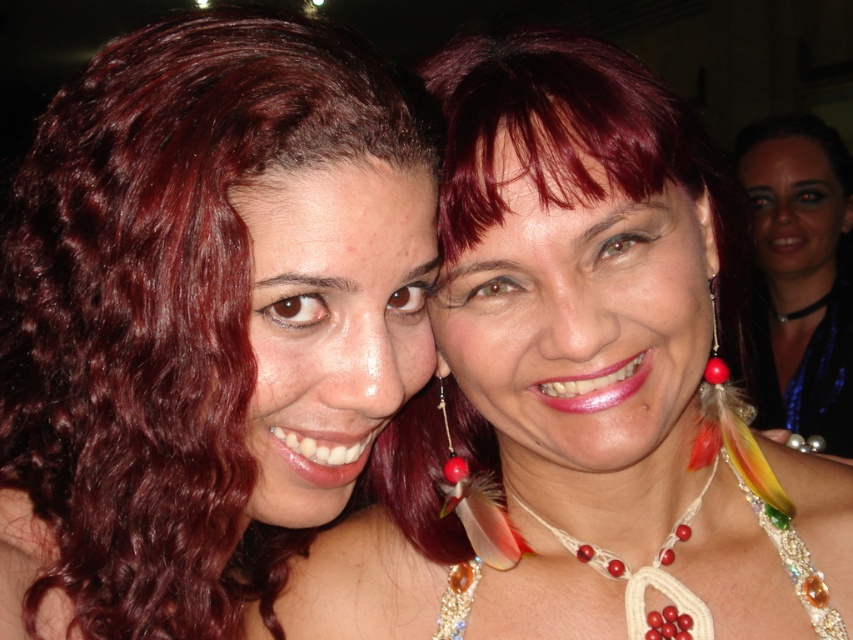
Question: Is the position of satin blue scarf at upper right more distant than that of blue sequined dress at upper right?

Choices:
 (A) yes
 (B) no

Answer: (A)

Question: Based on their relative distances, which object is nearer to the red glossy bead at ear?

Choices:
 (A) red beaded necklace at center
 (B) satin blue scarf at upper right

Answer: (A)

Question: Where is shiny red hair at upper left located in relation to blue sequined dress at upper right in the image?

Choices:
 (A) above
 (B) below

Answer: (A)

Question: Which object appears farthest from the camera in this image?

Choices:
 (A) satin blue scarf at upper right
 (B) blue sequined dress at upper right

Answer: (A)

Question: Which point is closer to the camera?

Choices:
 (A) red beaded necklace at center
 (B) shiny red hair at upper left
 (C) blue sequined dress at upper right
 (D) satin blue scarf at upper right

Answer: (B)

Question: Is blue sequined dress at upper right wider than red glossy bead at ear?

Choices:
 (A) no
 (B) yes

Answer: (B)